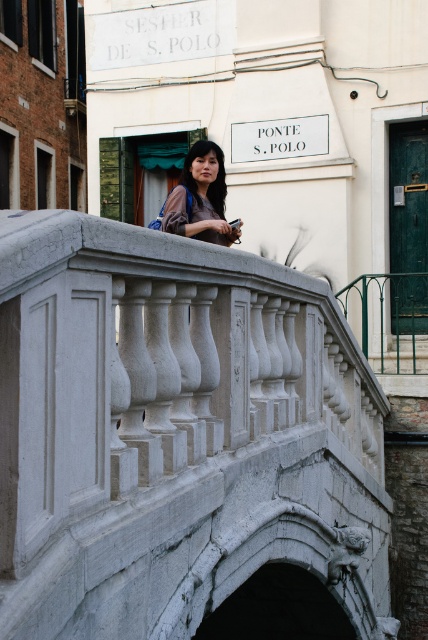
You are a tour guide leading a group across the historic bridge in Venice. You notice a tourist has left their matte black bag at center on the bridge. The white stone bridge at center has a weight limit of 1000 kg. If the bag weighs 5 kg, how many more bags like this can be placed on the bridge without exceeding the weight limit?

The white stone bridge at center has a weight limit of 1000 kg. Since the matte black bag at center weighs 5 kg, you can place 199 more bags of the same weight without exceeding the limit. This is calculated by subtracting the current bag weight from the limit and dividing by the bag weight, so 995 divided by 5 equals 199.

You are standing at point A, which is located at coordinates (175,433). What object is located at this point?

The white stone bridge at center is located at point A, which is at coordinates (175,433).